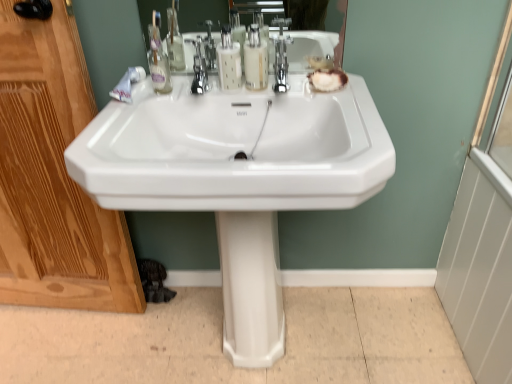
Image resolution: width=512 pixels, height=384 pixels. Find the location of `unoccupied region to the right of wooden screen door at left`. unoccupied region to the right of wooden screen door at left is located at coordinates (158, 337).